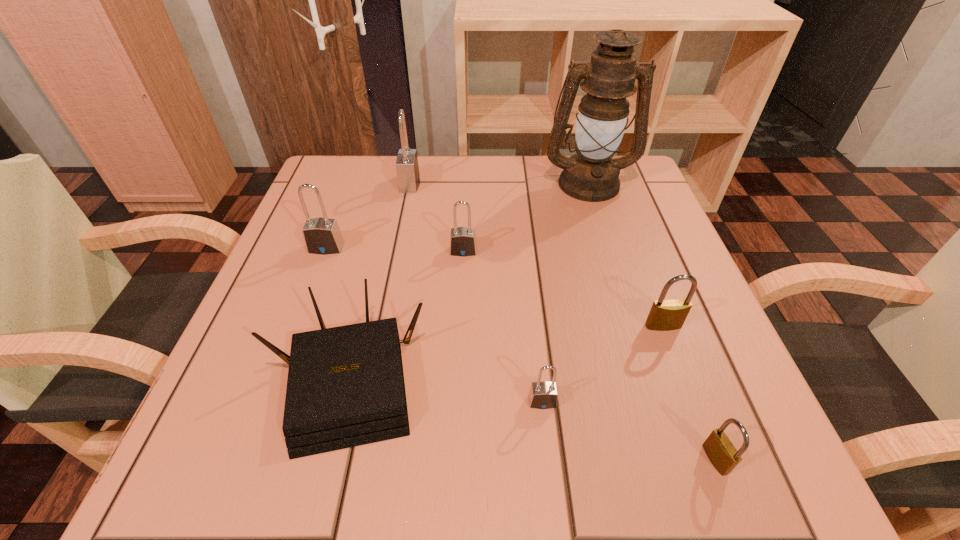
The image size is (960, 540). In order to click on the third padlock from right to left in this screenshot , I will do `click(543, 395)`.

The width and height of the screenshot is (960, 540). Identify the location of the rightmost gray padlock. (543, 395).

Where is `the smaller brass padlock`? the smaller brass padlock is located at coordinates (719, 449).

You are a GUI agent. You are given a task and a screenshot of the screen. Output one action in this format:
    pyautogui.click(x=<x>, y=<y>)
    Task: Click on the nearer brass padlock
    The width and height of the screenshot is (960, 540).
    Given the screenshot: What is the action you would take?
    pyautogui.click(x=719, y=449)

Locate an element on the screen. free space located on the front of the oil lamp is located at coordinates (603, 230).

The height and width of the screenshot is (540, 960). Find the location of `free space located on the shackle of the farthest padlock`. free space located on the shackle of the farthest padlock is located at coordinates (445, 183).

What are the coordinates of `free space located on the shackle of the leftmost padlock` in the screenshot? It's located at (299, 322).

This screenshot has width=960, height=540. What are the coordinates of `free space located 0.170m on the shackle of the fourth object from left to right` in the screenshot? It's located at (461, 324).

At what (x,y) coordinates should I click in order to perform the action: click on vacant space situated 0.250m on the left of the farther brass padlock. Please return your answer as a coordinate pair (x, y). This screenshot has width=960, height=540. Looking at the image, I should click on (497, 326).

Identify the location of blank area located on the right of the router. (457, 381).